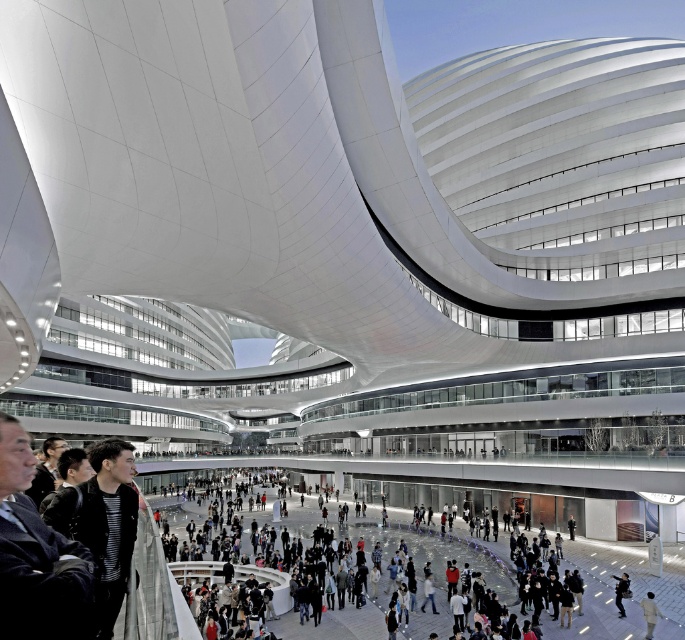
Which is below, white matte jacket at lower center or dark gray fabric jacket at lower center?

dark gray fabric jacket at lower center is below.

Does point (647, 616) come closer to viewer compared to point (614, 579)?

Yes, point (647, 616) is in front of point (614, 579).

Identify the location of white matte jacket at lower center. (649, 612).